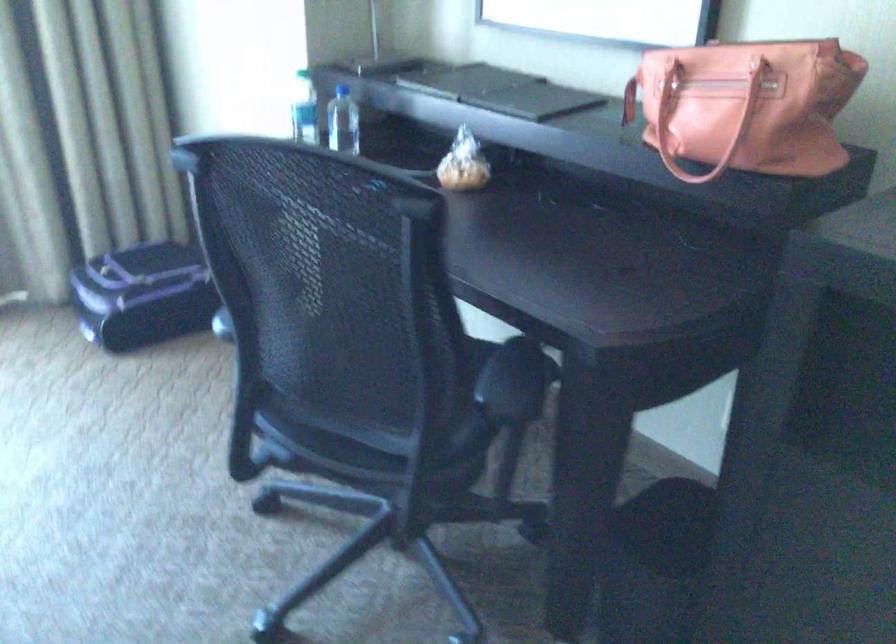
This screenshot has height=644, width=896. What do you see at coordinates (629, 100) in the screenshot? I see `the purple bag handle` at bounding box center [629, 100].